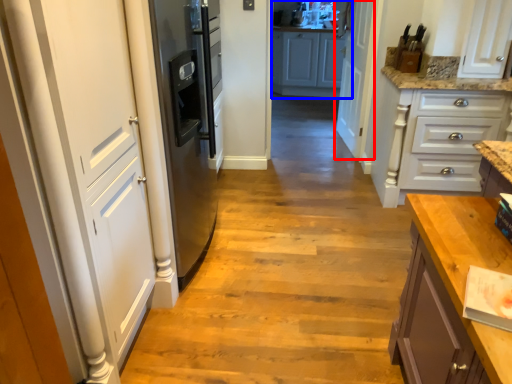
Question: Which object is further to the camera taking this photo, door (highlighted by a red box) or cabinetry (highlighted by a blue box)?

Choices:
 (A) door
 (B) cabinetry

Answer: (B)